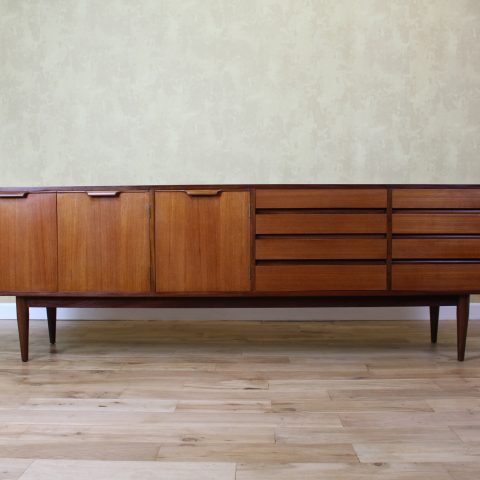
You are a GUI agent. You are given a task and a screenshot of the screen. Output one action in this format:
    pyautogui.click(x=<x>, y=<y>)
    Task: Click on the wooden cabinet doors
    This screenshot has height=480, width=480.
    Given the screenshot: What is the action you would take?
    pyautogui.click(x=21, y=242), pyautogui.click(x=103, y=249), pyautogui.click(x=205, y=246)